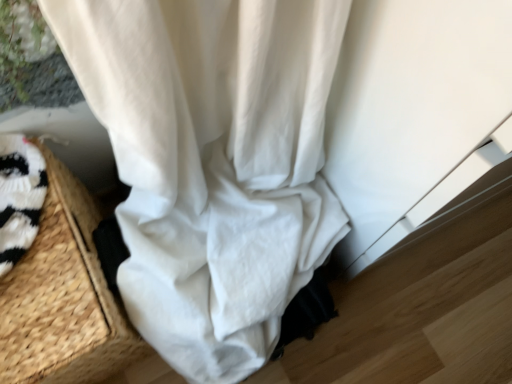
Question: Is point (223, 196) positioned closer to the camera than point (20, 329)?

Choices:
 (A) farther
 (B) closer

Answer: (A)

Question: Based on their positions, is white cotton curtain at center located to the left or right of woven straw basket at lower left?

Choices:
 (A) left
 (B) right

Answer: (B)

Question: Is white cotton curtain at center bigger or smaller than woven straw basket at lower left?

Choices:
 (A) small
 (B) big

Answer: (A)

Question: Is woven straw basket at lower left wider or thinner than white cotton curtain at center?

Choices:
 (A) wide
 (B) thin

Answer: (B)

Question: Considering the relative positions of woven straw basket at lower left and white cotton curtain at center in the image provided, is woven straw basket at lower left to the left or to the right of white cotton curtain at center?

Choices:
 (A) left
 (B) right

Answer: (A)

Question: In the image, is woven straw basket at lower left positioned in front of or behind white cotton curtain at center?

Choices:
 (A) front
 (B) behind

Answer: (A)

Question: Is woven straw basket at lower left taller or shorter than white cotton curtain at center?

Choices:
 (A) short
 (B) tall

Answer: (B)